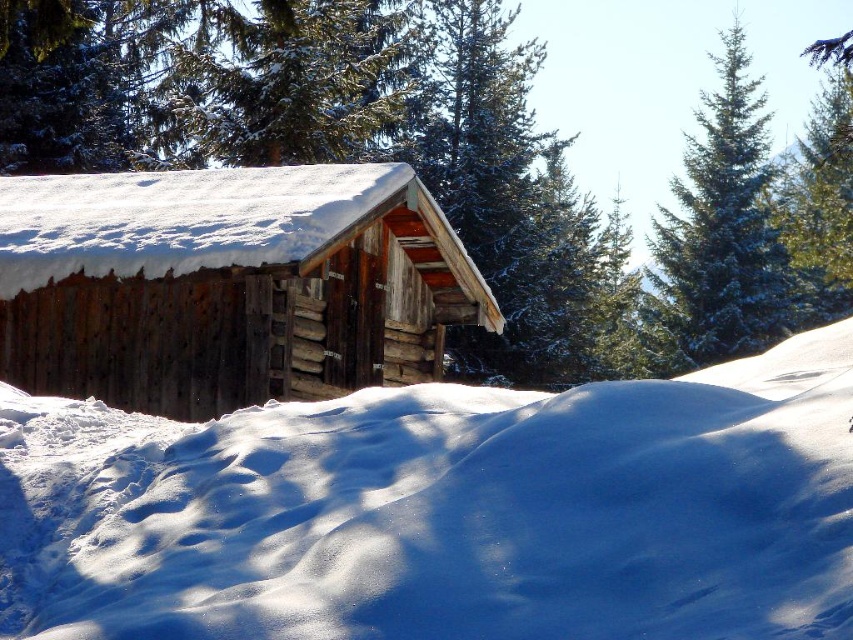
What do you see at coordinates (445, 513) in the screenshot? I see `white fluffy snow at center` at bounding box center [445, 513].

Can you confirm if white fluffy snow at center is shorter than rustic wood log cabin at center?

Yes.

Describe the element at coordinates (445, 513) in the screenshot. This screenshot has height=640, width=853. I see `white fluffy snow at center` at that location.

Identify the location of white fluffy snow at center. This screenshot has height=640, width=853. (445, 513).

Does point (281, 625) come closer to viewer compared to point (746, 212)?

Yes, it is.

Which is behind, point (399, 429) or point (686, 193)?

Positioned behind is point (686, 193).

Measure the distance between point (167,484) and camera.

They are 29.49 feet apart.

At what (x,y) coordinates should I click in order to perform the action: click on white fluffy snow at center. Please return your answer as a coordinate pair (x, y). Looking at the image, I should click on (445, 513).

Image resolution: width=853 pixels, height=640 pixels. What do you see at coordinates (410, 220) in the screenshot?
I see `green textured pine tree at upper center` at bounding box center [410, 220].

Who is positioned more to the right, green textured pine tree at upper center or white fluffy snow at center?

green textured pine tree at upper center

Does point (79, 188) lie in front of point (727, 534)?

That is False.

This screenshot has width=853, height=640. I want to click on green textured pine tree at upper center, so click(410, 220).